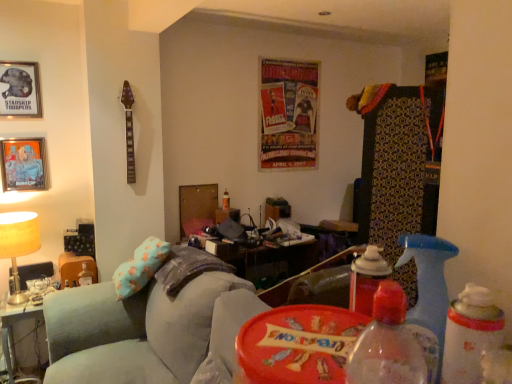
Locate an element on the screen. The image size is (512, 384). shiny paper poster at center is located at coordinates (289, 114).

Describe the element at coordinates (226, 200) in the screenshot. I see `translucent plastic bottle at center, the fourth bottle from the front` at that location.

Measure the distance between velvet teal swivel chair at lower left and camera.

A distance of 1.67 meters exists between velvet teal swivel chair at lower left and camera.

The width and height of the screenshot is (512, 384). What do you see at coordinates (20, 89) in the screenshot? I see `metallic silver picture frame at upper left, arranged as the 1th picture frame when viewed from the top` at bounding box center [20, 89].

Locate an element on the screen. The height and width of the screenshot is (384, 512). shiny paper poster at center is located at coordinates (289, 114).

What's the angular difference between orange matte picture frame at left, acting as the 1th picture frame starting from the bottom, and translucent plastic bottle at lower right, the 3th bottle positioned from the left,'s facing directions?

The angular difference between orange matte picture frame at left, acting as the 1th picture frame starting from the bottom, and translucent plastic bottle at lower right, the 3th bottle positioned from the left, is 90 degrees.

Looking at their sizes, would you say orange matte picture frame at left, acting as the 1th picture frame starting from the bottom, is wider or thinner than translucent plastic bottle at lower right, the second bottle viewed from the right?

Considering their sizes, orange matte picture frame at left, acting as the 1th picture frame starting from the bottom, looks slimmer than translucent plastic bottle at lower right, the second bottle viewed from the right.

Is orange matte picture frame at left, acting as the 1th picture frame starting from the bottom, not near translucent plastic bottle at lower right, the second bottle viewed from the right?

orange matte picture frame at left, acting as the 1th picture frame starting from the bottom, is far away from translucent plastic bottle at lower right, the second bottle viewed from the right.

From the image's perspective, is orange matte picture frame at left, arranged as the 2th picture frame when viewed from the top, positioned above or below translucent plastic bottle at lower right, the first bottle when ordered from front to back?

From the image's perspective, orange matte picture frame at left, arranged as the 2th picture frame when viewed from the top, appears above translucent plastic bottle at lower right, the first bottle when ordered from front to back.

Between orange matte picture frame at left, acting as the 1th picture frame starting from the bottom, and metallic silver picture frame at upper left, arranged as the 1th picture frame when viewed from the top, which one is positioned behind?

Positioned behind is orange matte picture frame at left, acting as the 1th picture frame starting from the bottom.

In the scene shown: From the image's perspective, which object appears higher, orange matte picture frame at left, arranged as the 2th picture frame when viewed from the top, or metallic silver picture frame at upper left, arranged as the 1th picture frame when viewed from the top?

metallic silver picture frame at upper left, arranged as the 1th picture frame when viewed from the top, appears higher in the image.

Is orange matte picture frame at left, arranged as the 2th picture frame when viewed from the top, facing away from metallic silver picture frame at upper left, arranged as the 1th picture frame when viewed from the top?

No.

Is orange matte picture frame at left, arranged as the 2th picture frame when viewed from the top, not inside metallic silver picture frame at upper left, arranged as the 1th picture frame when viewed from the top?

Indeed, orange matte picture frame at left, arranged as the 2th picture frame when viewed from the top, is completely outside metallic silver picture frame at upper left, arranged as the 1th picture frame when viewed from the top.

Does matte gold table lamp at left come in front of metallic silver picture frame at upper left, arranged as the 1th picture frame when viewed from the top?

Yes, matte gold table lamp at left is closer to the viewer.

Identify the location of table lamp in front of the metallic silver picture frame at upper left, which appears as the second picture frame when ordered from the bottom. The image size is (512, 384). (18, 244).

How different are the orientations of matte gold table lamp at left and metallic silver picture frame at upper left, arranged as the 1th picture frame when viewed from the top, in degrees?

They differ by 0.0024 degrees in their facing directions.

The width and height of the screenshot is (512, 384). I want to click on pillow above the translucent plastic bottle at lower left, placed as the 3th bottle when sorted from front to back (from the image's perspective), so click(x=140, y=267).

Does translucent plastic bottle at lower left, which is counted as the fourth bottle, starting from the right, have a lesser height compared to light blue fabric pillow at left?

Indeed, translucent plastic bottle at lower left, which is counted as the fourth bottle, starting from the right, has a lesser height compared to light blue fabric pillow at left.

Can you see translucent plastic bottle at lower left, which is counted as the fourth bottle, starting from the right, touching light blue fabric pillow at left?

translucent plastic bottle at lower left, which is counted as the fourth bottle, starting from the right, is not next to light blue fabric pillow at left, and they're not touching.

Is translucent plastic bottle at lower left, which ranks as the second bottle in back-to-front order, facing away from light blue fabric pillow at left?

No.

From the image's perspective, is velvet teal swivel chair at lower left positioned above or below shiny paper poster at center?

Clearly, from the image's perspective, velvet teal swivel chair at lower left is below shiny paper poster at center.

Does velvet teal swivel chair at lower left have a greater width compared to shiny paper poster at center?

Correct, the width of velvet teal swivel chair at lower left exceeds that of shiny paper poster at center.

Which is more to the left, velvet teal swivel chair at lower left or shiny paper poster at center?

Answer: Positioned to the left is velvet teal swivel chair at lower left.

Between point (225, 205) and point (121, 294), which one is positioned behind?

Positioned behind is point (225, 205).

From a real-world perspective, does translucent plastic bottle at center, which is counted as the 3th bottle, starting from the right, stand above light blue fabric pillow at left?

Yes, from a real-world perspective, translucent plastic bottle at center, which is counted as the 3th bottle, starting from the right, is over light blue fabric pillow at left

Looking at this image, is translucent plastic bottle at center, the 2th bottle in the left-to-right sequence, to the left or to the right of light blue fabric pillow at left in the image?

In the image, translucent plastic bottle at center, the 2th bottle in the left-to-right sequence, appears on the right side of light blue fabric pillow at left.

Is translucent plastic bottle at center, which is counted as the 3th bottle, starting from the right, facing towards light blue fabric pillow at left?

No, translucent plastic bottle at center, which is counted as the 3th bottle, starting from the right, does not turn towards light blue fabric pillow at left.

From the image's perspective, which is above, metallic silver picture frame at upper left, which appears as the second picture frame when ordered from the bottom, or light blue fabric pillow at left?

metallic silver picture frame at upper left, which appears as the second picture frame when ordered from the bottom.

In the image, is metallic silver picture frame at upper left, arranged as the 1th picture frame when viewed from the top, on the left side or the right side of light blue fabric pillow at left?

Clearly, metallic silver picture frame at upper left, arranged as the 1th picture frame when viewed from the top, is on the left of light blue fabric pillow at left in the image.

Considering the positions of objects metallic silver picture frame at upper left, which appears as the second picture frame when ordered from the bottom, and light blue fabric pillow at left in the image provided, who is behind, metallic silver picture frame at upper left, which appears as the second picture frame when ordered from the bottom, or light blue fabric pillow at left?

metallic silver picture frame at upper left, which appears as the second picture frame when ordered from the bottom, is further away from the camera.

Does metallic silver picture frame at upper left, which appears as the second picture frame when ordered from the bottom, contain light blue fabric pillow at left?

No, light blue fabric pillow at left is not surrounded by metallic silver picture frame at upper left, which appears as the second picture frame when ordered from the bottom.

There is a translucent plastic bottle at lower right, the 3th bottle positioned from the left. Where is `the 1st picture frame above it (from a real-world perspective)`? The height and width of the screenshot is (384, 512). the 1st picture frame above it (from a real-world perspective) is located at coordinates (23, 164).

Where is `picture frame located below the metallic silver picture frame at upper left, which appears as the second picture frame when ordered from the bottom (from the image's perspective)`? The image size is (512, 384). picture frame located below the metallic silver picture frame at upper left, which appears as the second picture frame when ordered from the bottom (from the image's perspective) is located at coordinates (23, 164).

Which object lies further to the anchor point white plastic table at lower left, translucent plastic spray bottle at right, which appears as the first bottle when viewed from the right, or velvet teal swivel chair at lower left?

Among the two, translucent plastic spray bottle at right, which appears as the first bottle when viewed from the right, is located further to white plastic table at lower left.

From the image, which object appears to be nearer to translucent plastic spray bottle at right, which is the fourth bottle from left to right, white plastic table at lower left or shiny paper poster at center?

white plastic table at lower left is closer to translucent plastic spray bottle at right, which is the fourth bottle from left to right.

When comparing their distances from translucent plastic bottle at lower left, marked as the first bottle in a left-to-right arrangement, does shiny paper poster at center or velvet teal swivel chair at lower left seem further?

The object further to translucent plastic bottle at lower left, marked as the first bottle in a left-to-right arrangement, is shiny paper poster at center.

From the image, which object appears to be farther from shiny paper poster at center, translucent plastic spray bottle at right, which is the fourth bottle from left to right, or light blue fabric pillow at left?

Among the two, translucent plastic spray bottle at right, which is the fourth bottle from left to right, is located further to shiny paper poster at center.

Which object lies further to the anchor point translucent plastic bottle at center, the 2th bottle in the left-to-right sequence, light blue fabric pillow at left or translucent plastic bottle at lower right, which is the fourth bottle in back-to-front order?

translucent plastic bottle at lower right, which is the fourth bottle in back-to-front order.

Estimate the real-world distances between objects in this image. Which object is further from white plastic table at lower left, translucent plastic bottle at lower right, which is the fourth bottle in back-to-front order, or shiny paper poster at center?

translucent plastic bottle at lower right, which is the fourth bottle in back-to-front order, is positioned further to the anchor white plastic table at lower left.

From the image, which object appears to be nearer to light blue fabric pillow at left, translucent plastic bottle at center, which is counted as the 3th bottle, starting from the right, or translucent plastic bottle at lower right, which is the fourth bottle in back-to-front order?

translucent plastic bottle at center, which is counted as the 3th bottle, starting from the right.

Based on their spatial positions, is metallic silver picture frame at upper left, which appears as the second picture frame when ordered from the bottom, or translucent plastic spray bottle at right, which appears as the first bottle when viewed from the right, closer to velvet teal swivel chair at lower left?

metallic silver picture frame at upper left, which appears as the second picture frame when ordered from the bottom, lies closer to velvet teal swivel chair at lower left than the other object.

At what (x,y) coordinates should I click in order to perform the action: click on picture frame between metallic silver picture frame at upper left, which appears as the second picture frame when ordered from the bottom, and translucent plastic bottle at center, marked as the 1th bottle in a back-to-front arrangement, from left to right. Please return your answer as a coordinate pair (x, y). This screenshot has width=512, height=384. Looking at the image, I should click on pos(23,164).

What are the coordinates of `picture frame positioned between translucent plastic spray bottle at right, which is the fourth bottle from left to right, and orange matte picture frame at left, acting as the 1th picture frame starting from the bottom, from near to far` in the screenshot? It's located at (20, 89).

You are a GUI agent. You are given a task and a screenshot of the screen. Output one action in this format:
    pyautogui.click(x=<x>, y=<y>)
    Task: Click on the bottle positioned between translucent plastic spray bottle at right, the third bottle from the back, and translucent plastic bottle at center, which is counted as the 3th bottle, starting from the right, from near to far
    
    Given the screenshot: What is the action you would take?
    pyautogui.click(x=85, y=276)

Where is `swivel chair between translucent plastic bottle at lower right, the 3th bottle positioned from the left, and translucent plastic bottle at center, the 2th bottle in the left-to-right sequence, along the z-axis`? This screenshot has height=384, width=512. swivel chair between translucent plastic bottle at lower right, the 3th bottle positioned from the left, and translucent plastic bottle at center, the 2th bottle in the left-to-right sequence, along the z-axis is located at coordinates (135, 329).